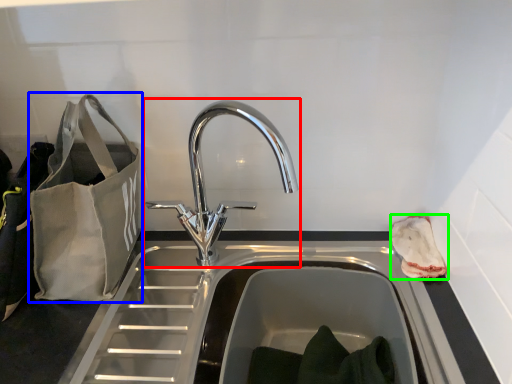
Question: Based on their relative distances, which object is farther from tap (highlighted by a red box)? Choose from bag (highlighted by a blue box) and pouch (highlighted by a green box).

Choices:
 (A) bag
 (B) pouch

Answer: (B)